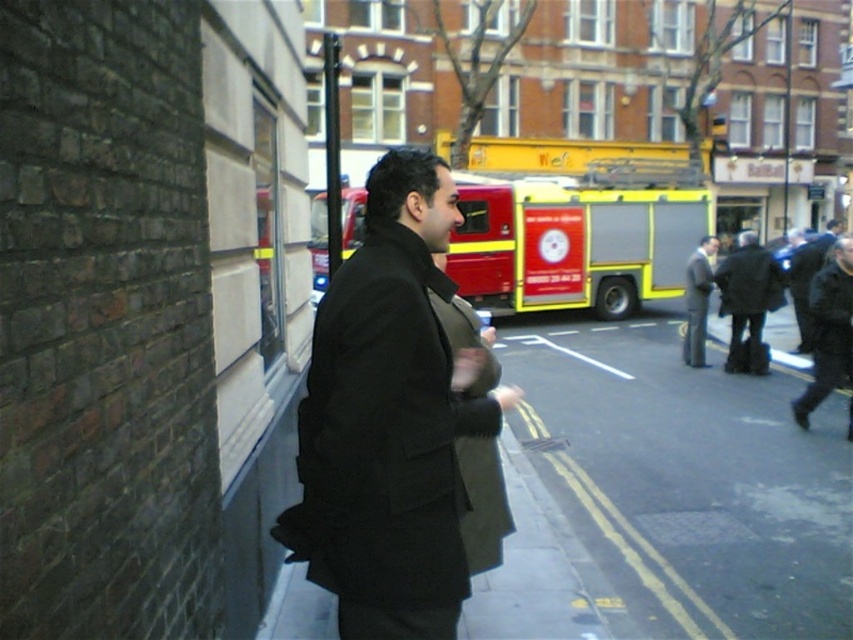
Which of these two, dark gray coat at right or dark wool coat at center, stands shorter?

dark gray coat at right

Who is more forward, (799, 412) or (782, 288)?

Positioned in front is point (799, 412).

Who is more forward, (849, 296) or (726, 259)?

Point (849, 296) is in front.

Image resolution: width=853 pixels, height=640 pixels. I want to click on dark gray coat at right, so click(x=828, y=330).

Who is taller, smooth asphalt road at center or matte black coat at center?

With more height is matte black coat at center.

Does smooth asphalt road at center appear under matte black coat at center?

Indeed, smooth asphalt road at center is positioned under matte black coat at center.

Who is more forward, (576, 496) or (343, 465)?

Positioned in front is point (343, 465).

Where is `smooth asphalt road at center`? This screenshot has width=853, height=640. smooth asphalt road at center is located at coordinates (688, 476).

Consider the image. Is matte black coat at center shorter than dark gray jacket at center?

Yes.

Measure the distance between point (363,300) and camera.

Point (363,300) is 6.65 feet from camera.

At what (x,y) coordinates should I click in order to perform the action: click on matte black coat at center. Please return your answer as a coordinate pair (x, y). Looking at the image, I should click on (389, 419).